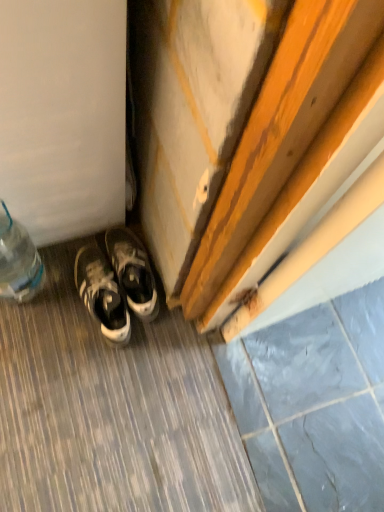
Question: From the image's perspective, relative to white leather sneakers at lower left, is white leather sneakers at lower left above or below?

Choices:
 (A) below
 (B) above

Answer: (B)

Question: From their relative heights in the image, would you say white leather sneakers at lower left is taller or shorter than white leather sneakers at lower left?

Choices:
 (A) short
 (B) tall

Answer: (A)

Question: Which is farther from the gray stone tile at lower right?

Choices:
 (A) white leather sneakers at lower left
 (B) white leather sneakers at lower left
 (C) clear plastic bottle at lower left

Answer: (C)

Question: Estimate the real-world distances between objects in this image. Which object is closer to the white leather sneakers at lower left?

Choices:
 (A) white leather sneakers at lower left
 (B) gray stone tile at lower right
 (C) clear plastic bottle at lower left

Answer: (A)